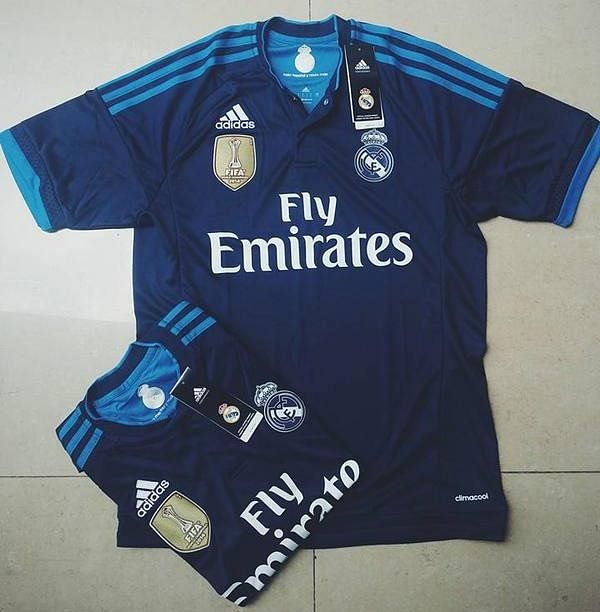
At what (x,y) coordinates should I click in order to perform the action: click on greyish, white tile background. Please return your answer as a coordinate pair (x, y). Image resolution: width=600 pixels, height=612 pixels. Looking at the image, I should click on (89, 329).